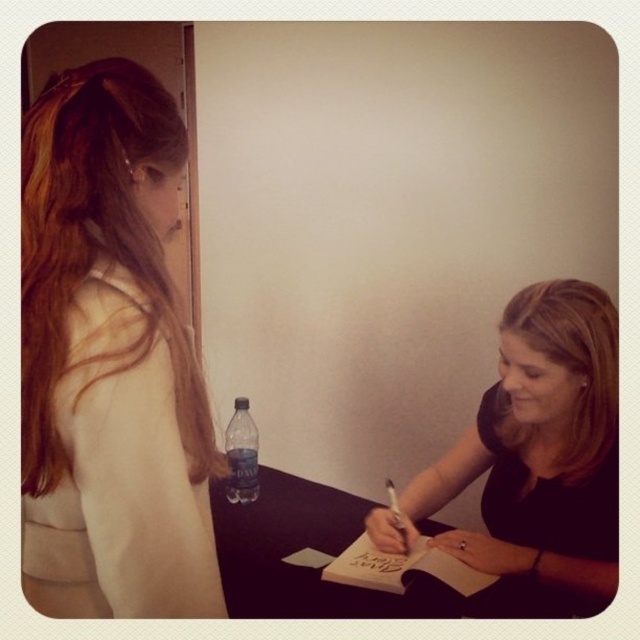
You are a delivery robot with a 24 inch wide package. You need to place the package on the table between the matte beige sweater at left and the black matte pen at center. Is there enough space for the package?

The distance between the matte beige sweater at left and the black matte pen at center is 25.25 inches. Since the package is 24 inches wide, there is enough space to place it between them.

You are a delivery person who needs to place a small package between the transparent plastic bottle at center and the smooth paper note at lower center. Can you fit it there?

The transparent plastic bottle at center is bigger than smooth paper note at lower center, so there might not be enough space between them to fit a small package. Check the available space carefully before placing the package.

You are standing in the room and want to move from the point at coordinates point (216, 534) to the point at coordinates point (234, 499). Which direction should you move in to reach the second point?

To move from point (216, 534) to point (234, 499), you should move to the left and slightly backward since point (216, 534) is in front of point (234, 499).